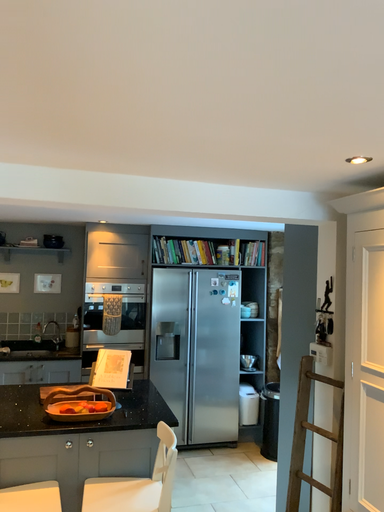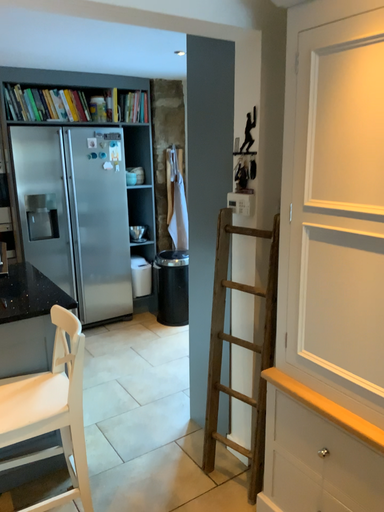
Question: How did the camera likely rotate when shooting the video?

Choices:
 (A) rotated downward
 (B) rotated upward

Answer: (A)